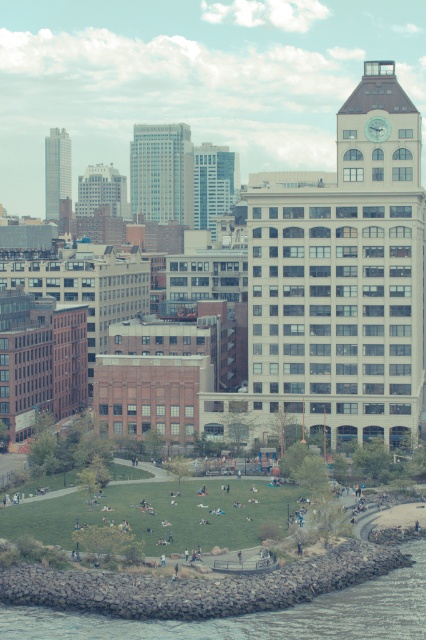
Question: Is gray rock wall at lower left thinner than smooth glass skyscraper at center?

Choices:
 (A) yes
 (B) no

Answer: (B)

Question: Which object is the farthest from the white glass building at center?

Choices:
 (A) smooth glass skyscraper at center
 (B) white smooth building at right
 (C) smooth glass skyscraper at upper left
 (D) gray rock wall at lower left

Answer: (D)

Question: Is smooth glass skyscraper at center above smooth glass skyscraper at upper left?

Choices:
 (A) no
 (B) yes

Answer: (B)

Question: Which of these objects is positioned farthest from the smooth glass skyscraper at center?

Choices:
 (A) gray rock wall at lower left
 (B) white smooth building at right
 (C) white glass building at center
 (D) smooth glass skyscraper at upper left

Answer: (A)

Question: Does gray rock wall at lower left have a lesser width compared to smooth glass skyscraper at center?

Choices:
 (A) yes
 (B) no

Answer: (B)

Question: Which object is positioned farthest from the gray rock wall at lower left?

Choices:
 (A) white smooth building at right
 (B) smooth glass skyscraper at upper left
 (C) white glass building at center

Answer: (B)